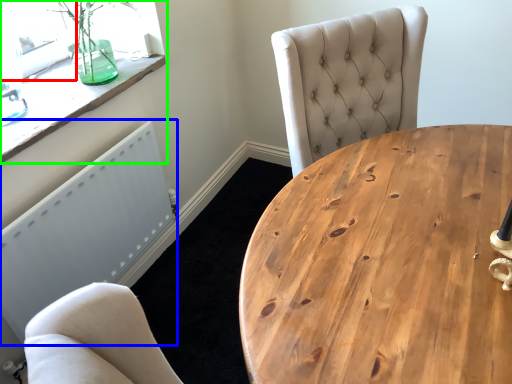
Question: Considering the real-world distances, which object is closest to window screen (highlighted by a red box)? radiator (highlighted by a blue box) or window (highlighted by a green box).

Choices:
 (A) radiator
 (B) window

Answer: (B)